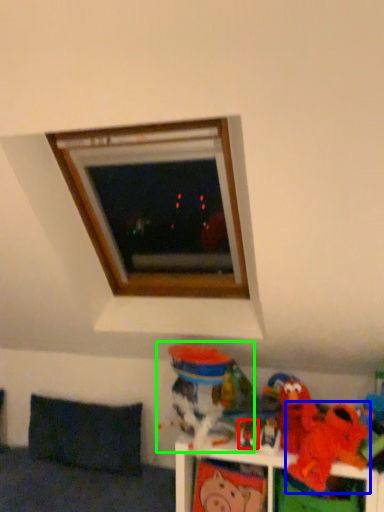
Question: Based on their relative distances, which object is nearer to toy (highlighted by a red box)? Choose from toy (highlighted by a blue box) and toy (highlighted by a green box).

Choices:
 (A) toy
 (B) toy

Answer: (B)